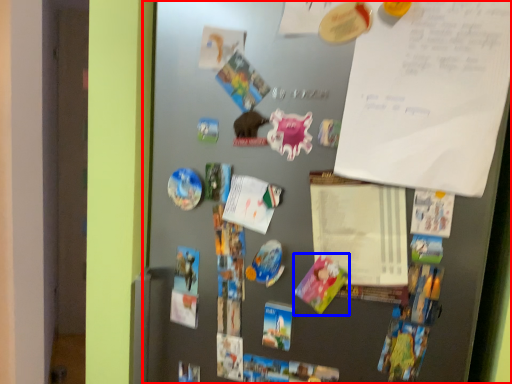
Question: Which of the following is the closest to the observer, fridge (highlighted by a red box) or postcard (highlighted by a blue box)?

Choices:
 (A) fridge
 (B) postcard

Answer: (A)